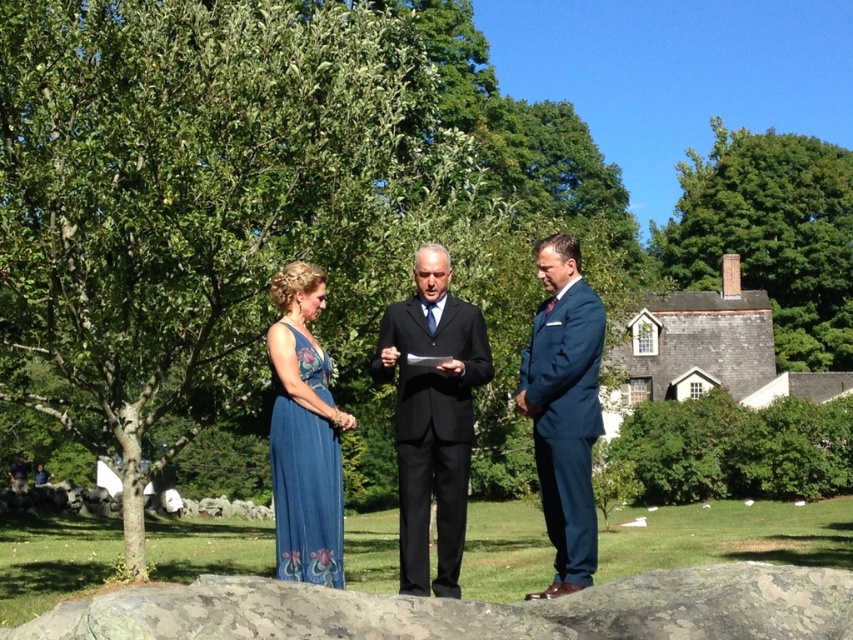
You are standing at point A located at coordinates point (x=802, y=285) and want to walk to point B at point (x=418, y=456). However, there is a large rock in your path. Can you see point B from your current position at point A?

Point (x=802, y=285) is behind point (x=418, y=456), so you cannot see point B from your current position at point A because point A is obstructed by the rock located in front of it.